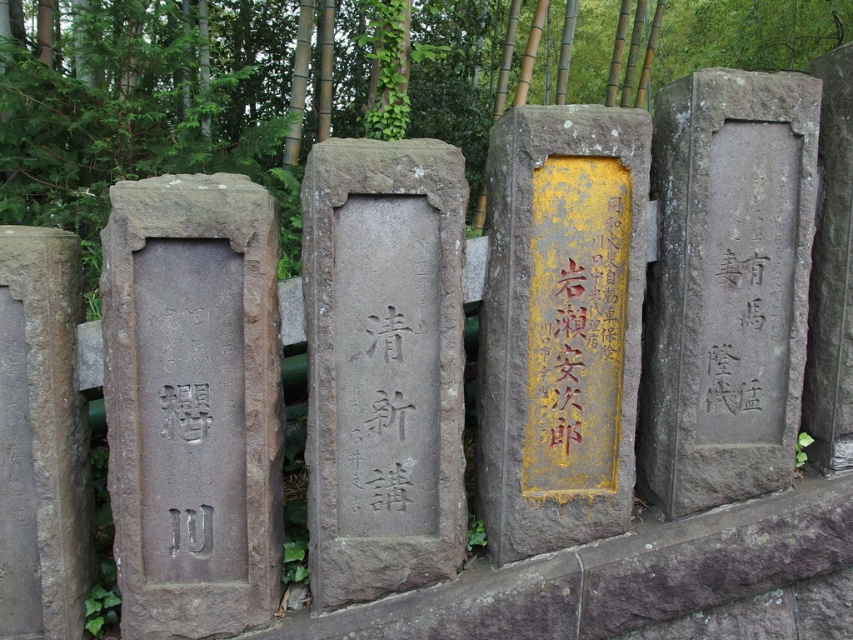
You are standing at the camera position in the scene. You want to touch the brown stone gravestone at left. Can you reach it without moving your feet?

The brown stone gravestone at left and camera are 2.24 meters apart from each other, so you cannot reach it without moving your feet as the distance is too far.